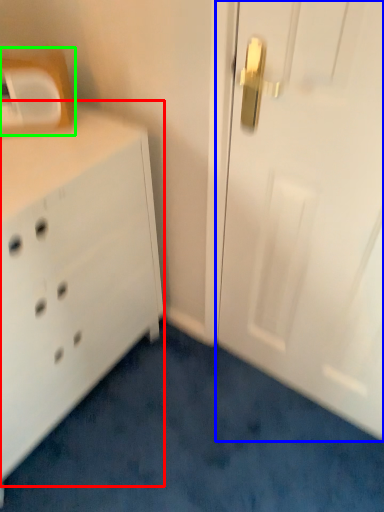
Question: Based on their relative distances, which object is nearer to chest of drawers (highlighted by a red box)? Choose from door (highlighted by a blue box) and medicine cabinet (highlighted by a green box).

Choices:
 (A) door
 (B) medicine cabinet

Answer: (B)